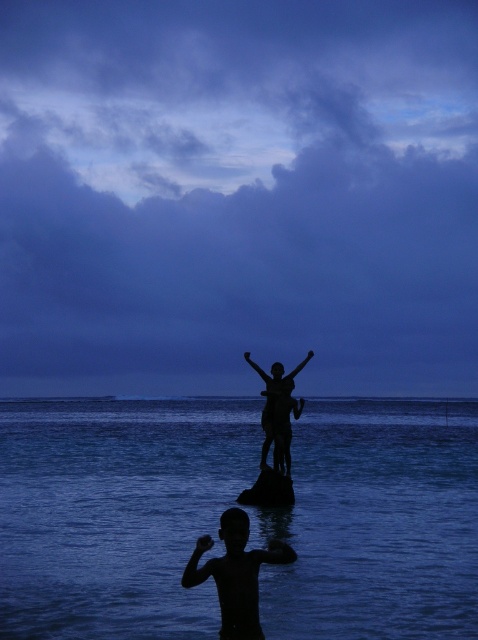
You are a photographer trying to capture the reflection of the dark blue water at center in your shot. Based on its position, where should you aim your camera to ensure the reflection is centered in the frame?

To center the reflection of the dark blue water at center in the frame, aim your camera at the coordinates point (116, 512) since that is where the dark blue water at center is located.

You are a photographer trying to capture the silhouette statue at center and the dark blue water at center in the same frame. Based on their positions, which object should you focus on first to ensure both are in focus?

The dark blue water at center is in front of the silhouette statue at center. To ensure both are in focus, you should focus on the silhouette statue at center first since it is further away, allowing the dark blue water at center in front to still be within the depth of field.